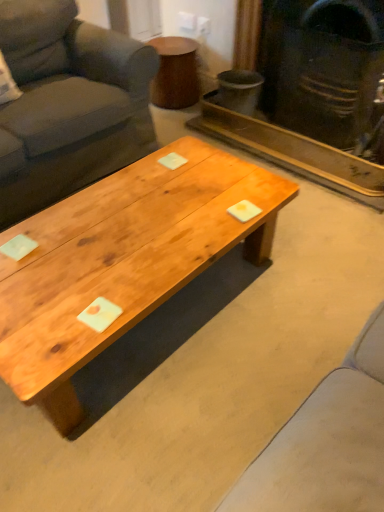
This screenshot has height=512, width=384. Find the location of `free spot above wooden side table at upper center (from a real-world perspective)`. free spot above wooden side table at upper center (from a real-world perspective) is located at coordinates (171, 41).